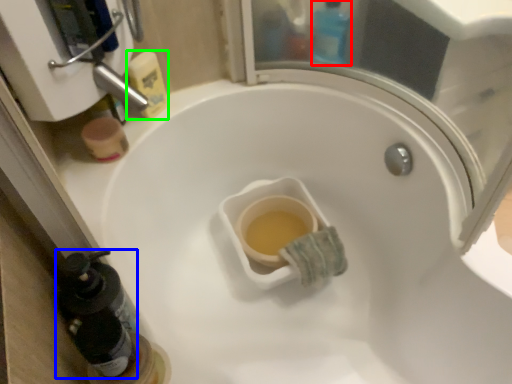
Question: Which is nearer to the bottle (highlighted by a red box)? bottle (highlighted by a blue box) or cleaning product (highlighted by a green box).

Choices:
 (A) bottle
 (B) cleaning product

Answer: (B)